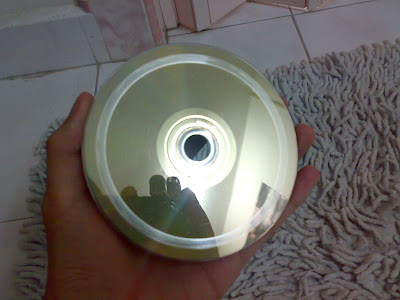
Find the location of a particular element. floor is located at coordinates (270, 35).